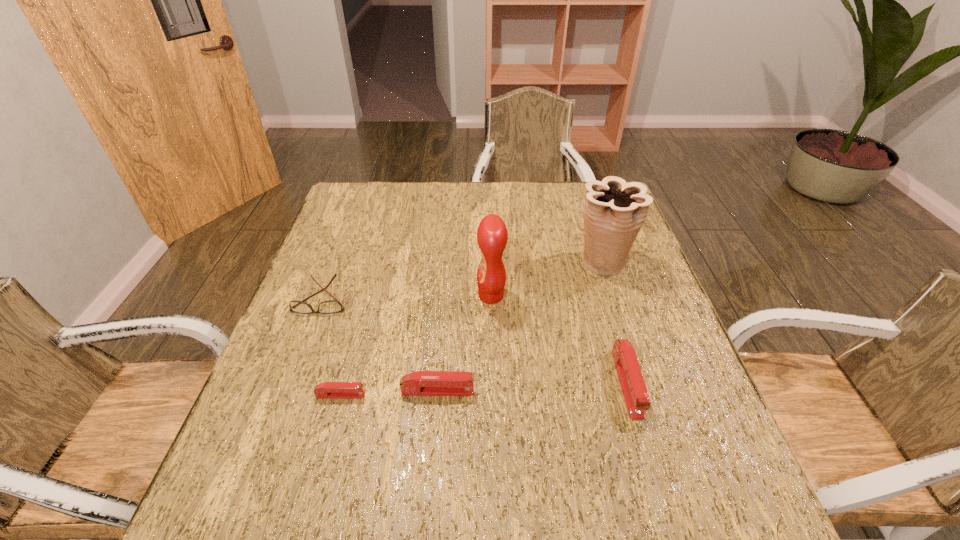
What are the coordinates of `the leftmost stapler` in the screenshot? It's located at (328, 390).

The image size is (960, 540). What are the coordinates of `the second stapler from right to left` in the screenshot? It's located at (421, 383).

At what (x,y) coordinates should I click in order to perform the action: click on the second shortest stapler. Please return your answer as a coordinate pair (x, y). Looking at the image, I should click on (421, 383).

Identify the location of the rightmost stapler. (634, 390).

The width and height of the screenshot is (960, 540). In order to click on the fourth object from left to right in this screenshot , I will do `click(492, 235)`.

I want to click on urn, so click(x=614, y=212).

Identify the location of spectacles. The image size is (960, 540). (331, 306).

In order to click on vacant space located 0.390m on the front-facing side of the leftmost stapler in this screenshot , I will do `click(554, 395)`.

This screenshot has height=540, width=960. What are the coordinates of `vacant space located on the front-facing side of the third object from left to right` in the screenshot? It's located at (564, 391).

Identify the location of blank area located on the front-facing side of the rightmost stapler. (644, 444).